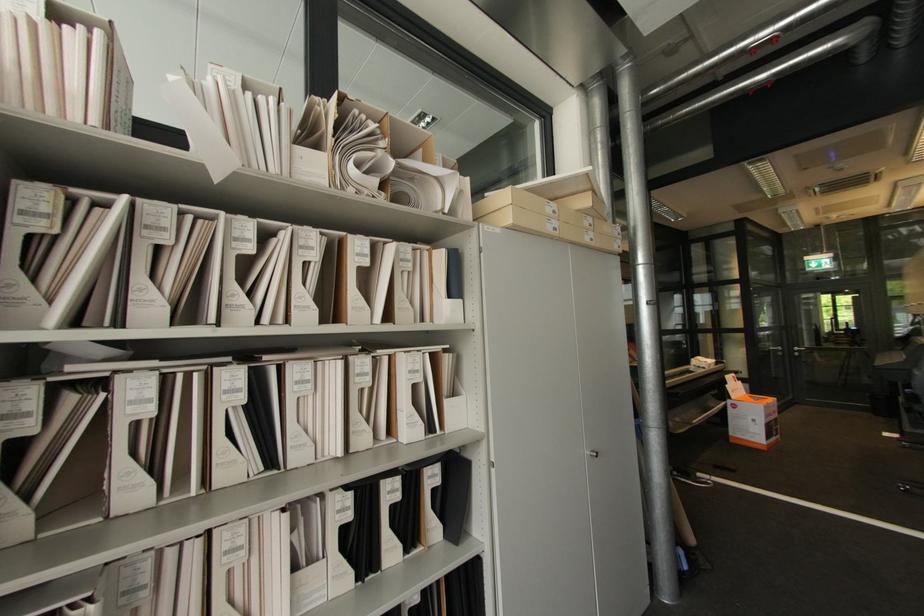
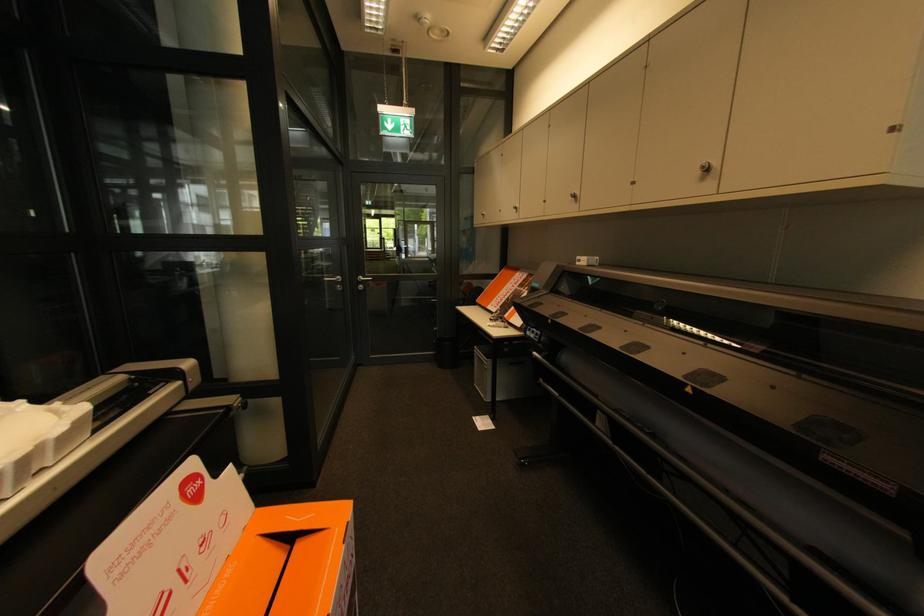
The point at [800,354] is marked in the first image. Where is the corresponding point in the second image?

(365, 286)